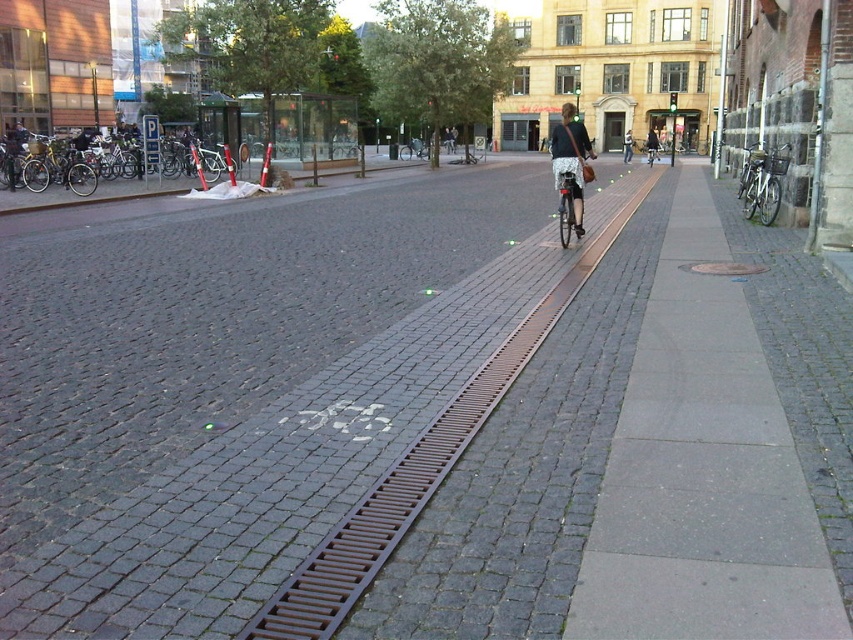
You are a delivery person who needs to load a package onto your bike. You see the silver metallic bicycle at center and the dark gray jacket at center. Which object is smaller and thus easier to maneuver in tight spaces?

The silver metallic bicycle at center is smaller than the dark gray jacket at center, so it would be easier to maneuver in tight spaces.

You are a pedestrian walking on the sidewalk and want to cross the street to reach the building with the door. There is a shiny silver bicycle at center and dark blue jeans at center in your path. Which object should you move around to avoid collision with the cyclist?

You should move around the dark blue jeans at center because it is behind the shiny silver bicycle at center, so the cyclist is likely moving forward in the bike lane, and the jeans might be an obstacle on the sidewalk that you can step over or walk around to stay clear of the bike lane.